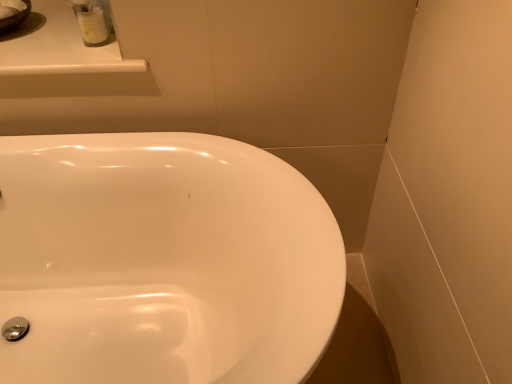
You are a GUI agent. You are given a task and a screenshot of the screen. Output one action in this format:
    pyautogui.click(x=<x>, y=<y>)
    Task: Click on the white glossy container at upper left
    
    Given the screenshot: What is the action you would take?
    pyautogui.click(x=91, y=22)

What is the approximate height of white glossy counter top at upper left?

3.56 centimeters.

Locate an element on the screen. white glossy sink at center is located at coordinates (163, 261).

The image size is (512, 384). In order to click on toiletry located on the left of white glossy sink at center in this screenshot , I will do `click(91, 22)`.

Considering the sizes of objects white glossy container at upper left and white glossy sink at center in the image provided, who is shorter, white glossy container at upper left or white glossy sink at center?

With less height is white glossy container at upper left.

Between white glossy container at upper left and white glossy sink at center, which one is positioned behind?

white glossy container at upper left is more distant.

Which of these two, white glossy container at upper left or white glossy sink at center, is wider?

Wider between the two is white glossy sink at center.

This screenshot has height=384, width=512. Find the location of `counter top that is on the left side of white glossy container at upper left`. counter top that is on the left side of white glossy container at upper left is located at coordinates (58, 46).

Consider the image. Considering the positions of objects white glossy counter top at upper left and white glossy container at upper left in the image provided, who is more to the left, white glossy counter top at upper left or white glossy container at upper left?

white glossy counter top at upper left is more to the left.

Looking at this image, is white glossy counter top at upper left shorter than white glossy container at upper left?

Indeed, white glossy counter top at upper left has a lesser height compared to white glossy container at upper left.

What's the angular difference between white glossy counter top at upper left and white glossy container at upper left's facing directions?

6.77 degrees separate the facing orientations of white glossy counter top at upper left and white glossy container at upper left.

From a real-world perspective, which object rests below the other?

From a 3D spatial view, white glossy sink at center is below.

Consider the image. Is white glossy sink at center at the left side of white glossy container at upper left?

No.

Can you tell me how much white glossy sink at center and white glossy container at upper left differ in facing direction?

7.56 degrees.

Which is in front, point (76, 171) or point (94, 1)?

The point (94, 1) is closer to the camera.

Does point (302, 362) come in front of point (58, 29)?

Yes.

Can you tell me how much white glossy sink at center and white glossy counter top at upper left differ in facing direction?

There is a 0.787-degree angle between the facing directions of white glossy sink at center and white glossy counter top at upper left.

Considering the sizes of white glossy sink at center and white glossy counter top at upper left in the image, is white glossy sink at center taller or shorter than white glossy counter top at upper left?

Clearly, white glossy sink at center is taller compared to white glossy counter top at upper left.

Visually, is white glossy counter top at upper left positioned to the left or to the right of white glossy sink at center?

From the image, it's evident that white glossy counter top at upper left is to the left of white glossy sink at center.

Choose the correct answer: Is white glossy counter top at upper left inside white glossy sink at center or outside it?

The correct answer is: outside.

The width and height of the screenshot is (512, 384). I want to click on counter top lying above the white glossy sink at center (from the image's perspective), so click(58, 46).

Which point is more forward, (99, 36) or (71, 28)?

Point (99, 36)

Considering the sizes of objects white glossy container at upper left and white glossy counter top at upper left in the image provided, who is smaller, white glossy container at upper left or white glossy counter top at upper left?

white glossy container at upper left is smaller.

Is white glossy container at upper left oriented away from white glossy counter top at upper left?

No, white glossy container at upper left is not facing away from white glossy counter top at upper left.

Is the depth of white glossy container at upper left greater than that of white glossy counter top at upper left?

Yes, it is behind white glossy counter top at upper left.

What are the coordinates of `sink below the white glossy container at upper left (from a real-world perspective)` in the screenshot? It's located at (163, 261).

This screenshot has width=512, height=384. In order to click on toiletry that is above the white glossy counter top at upper left (from a real-world perspective) in this screenshot , I will do `click(91, 22)`.

Considering their positions, is white glossy counter top at upper left positioned further to white glossy container at upper left than white glossy sink at center?

white glossy sink at center lies further to white glossy container at upper left than the other object.

Looking at the image, which one is located closer to white glossy sink at center, white glossy container at upper left or white glossy counter top at upper left?

Among the two, white glossy counter top at upper left is located nearer to white glossy sink at center.

Looking at this image, when comparing their distances from white glossy counter top at upper left, does white glossy container at upper left or white glossy sink at center seem further?

white glossy sink at center is positioned further to the anchor white glossy counter top at upper left.

Which object lies further to the anchor point white glossy counter top at upper left, white glossy sink at center or white glossy container at upper left?

white glossy sink at center is positioned further to the anchor white glossy counter top at upper left.

Considering their positions, is white glossy counter top at upper left positioned closer to white glossy sink at center than white glossy container at upper left?

white glossy counter top at upper left lies closer to white glossy sink at center than the other object.

Based on their spatial positions, is white glossy sink at center or white glossy counter top at upper left further from white glossy container at upper left?

white glossy sink at center.

Where is `toiletry that lies between white glossy counter top at upper left and white glossy sink at center from top to bottom`? toiletry that lies between white glossy counter top at upper left and white glossy sink at center from top to bottom is located at coordinates (91, 22).